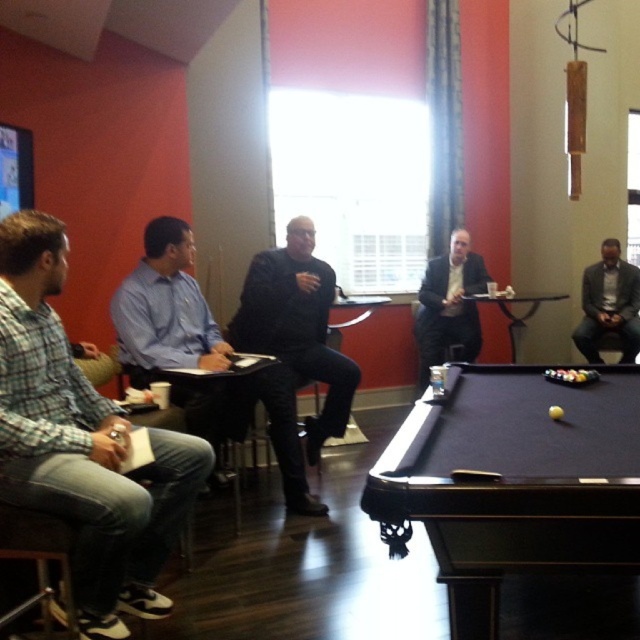
Question: Can you confirm if matte black suit at center is wider than dark gray suit at center?

Choices:
 (A) no
 (B) yes

Answer: (B)

Question: Which of the following is the closest to the observer?

Choices:
 (A) plaid cotton shirt at left
 (B) matte black suit at center
 (C) dark felt pool table at lower right

Answer: (C)

Question: Is plaid cotton shirt at left below blue shirt at center?

Choices:
 (A) yes
 (B) no

Answer: (A)

Question: Among these objects, which one is farthest from the camera?

Choices:
 (A) dark gray suit at center
 (B) black matte jacket at center

Answer: (A)

Question: Which point appears farthest from the camera in this image?

Choices:
 (A) (460, 284)
 (B) (19, 240)

Answer: (A)

Question: Does plaid cotton shirt at left appear on the left side of blue shirt at center?

Choices:
 (A) yes
 (B) no

Answer: (A)